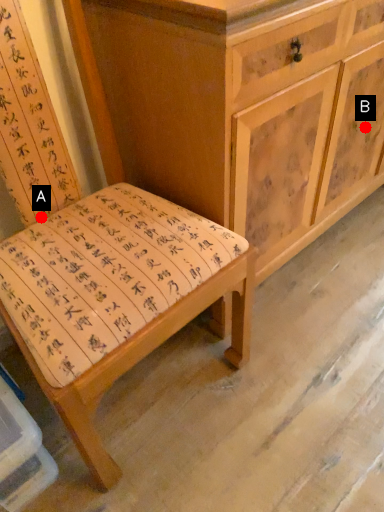
Question: Two points are circled on the image, labeled by A and B beside each circle. Which point is further to the camera?

Choices:
 (A) A is further
 (B) B is further

Answer: (B)